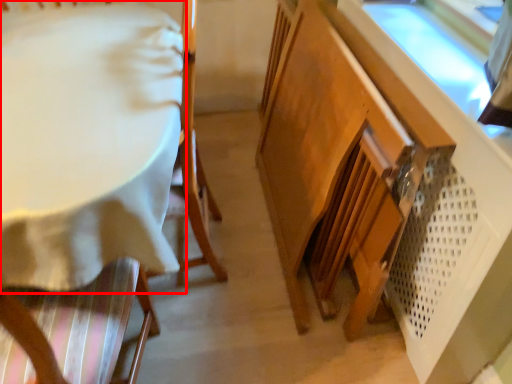
Question: From the image's perspective, considering the relative positions of table (annotated by the red box) and cabinetry in the image provided, where is table (annotated by the red box) located with respect to the staircase?

Choices:
 (A) below
 (B) above

Answer: (B)